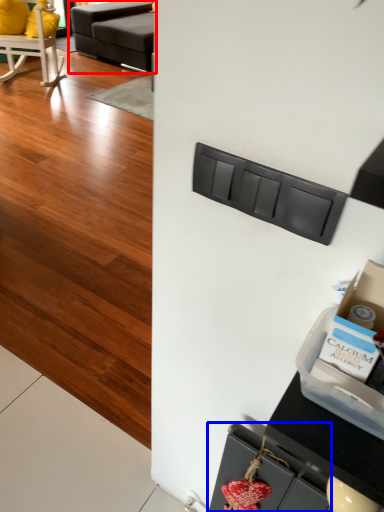
Question: Among these objects, which one is farthest to the camera, studio couch (highlighted by a red box) or drawer (highlighted by a blue box)?

Choices:
 (A) studio couch
 (B) drawer

Answer: (A)